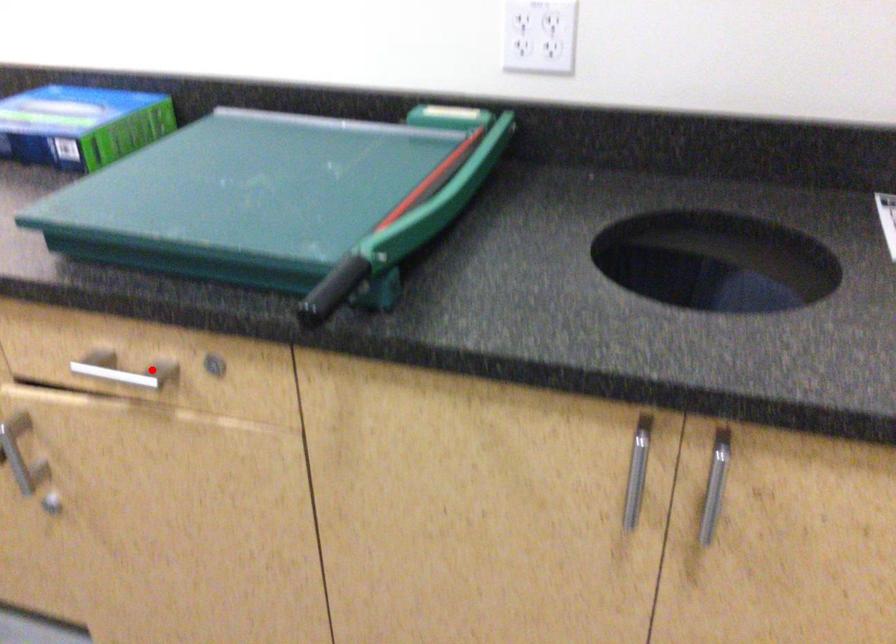
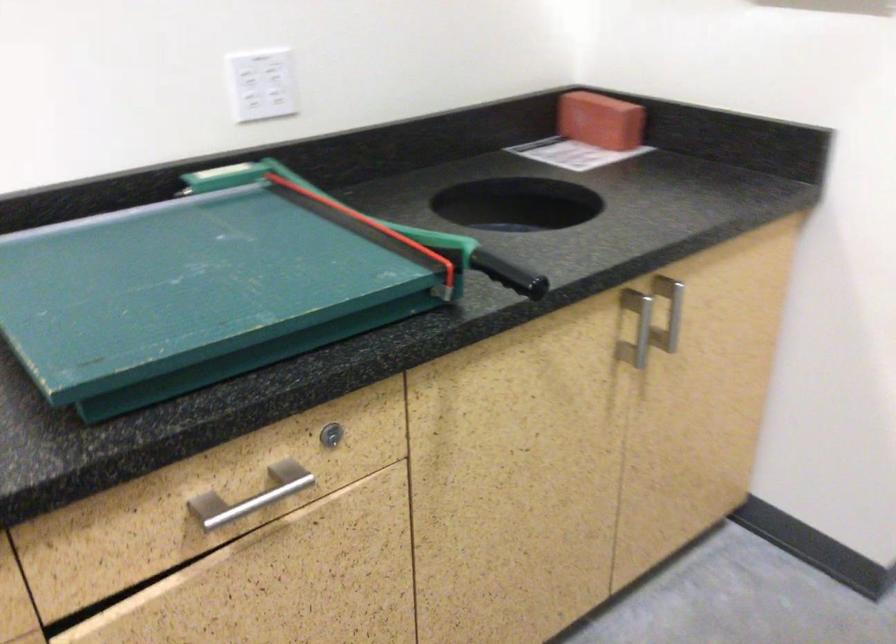
Question: I am providing you with two images of the same scene from different viewpoints. A red point is marked on the first image. Can you still see the location of the red point in image 2?

Choices:
 (A) Yes
 (B) No

Answer: (A)